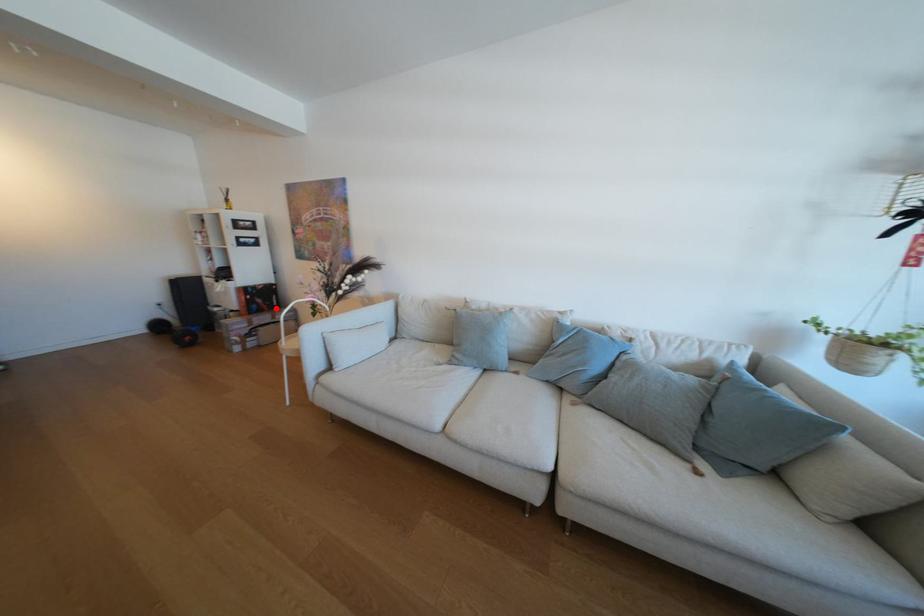
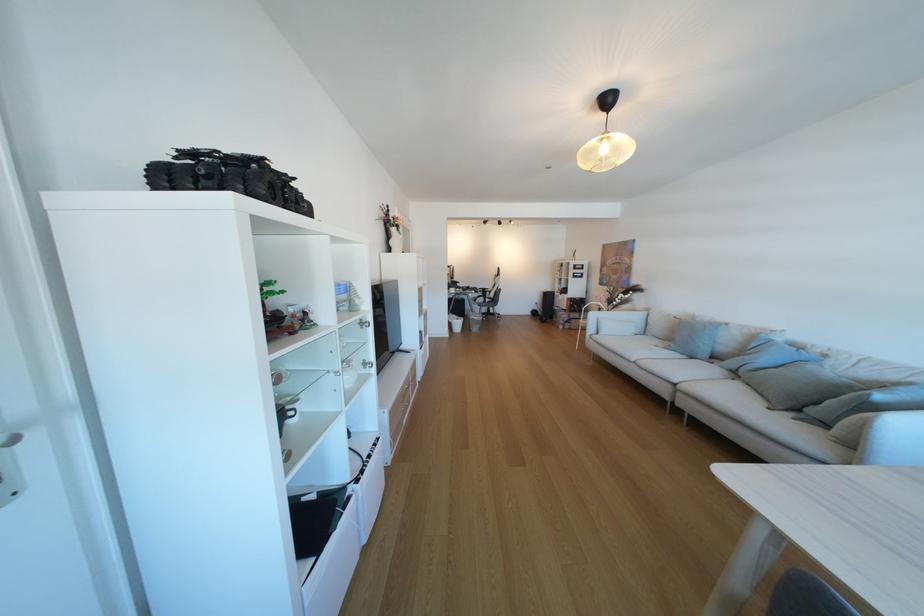
In the second image, find the point that corresponds to the highlighted location in the first image.

(589, 310)